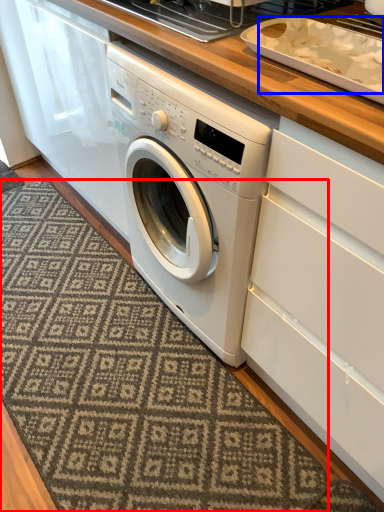
Question: Which object appears closest to the camera in this image, doormat (highlighted by a red box) or food (highlighted by a blue box)?

Choices:
 (A) doormat
 (B) food

Answer: (B)